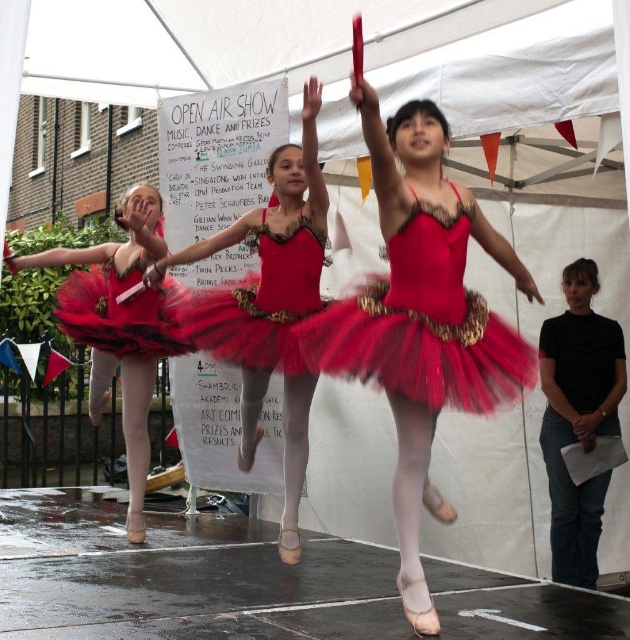
Who is positioned more to the left, shiny red tutu at center or red tulle tutu at left?

red tulle tutu at left is more to the left.

Measure the distance between shiny red tutu at center and camera.

12.70 feet

This screenshot has height=640, width=630. Find the location of `shiny red tutu at center`. shiny red tutu at center is located at coordinates (421, 320).

Does point (277, 236) come in front of point (142, 465)?

Yes, point (277, 236) is closer to viewer.

Who is positioned more to the right, matte red tutu at center or matte red tutu at left?

From the viewer's perspective, matte red tutu at center appears more on the right side.

Is point (278, 525) positioned after point (106, 276)?

Yes, it is.

What are the coordinates of `matte red tutu at center` in the screenshot? It's located at (270, 305).

Which is in front, point (146, 433) or point (105, 276)?

Point (105, 276) is in front.

Who is taller, matte red tutu at left or red tulle tutu at left?

With more height is matte red tutu at left.

Where is `matte red tutu at left`? The image size is (630, 640). matte red tutu at left is located at coordinates (120, 321).

Find the location of a particular element. This screenshot has width=630, height=640. matte red tutu at left is located at coordinates (120, 321).